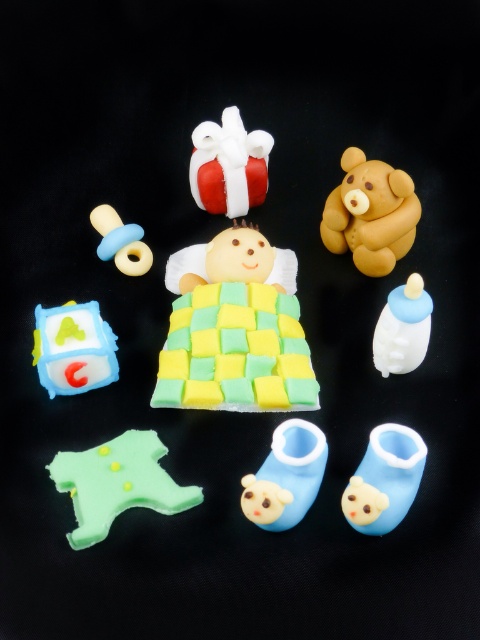
Which is behind, point (75, 532) or point (56, 308)?

The point (56, 308) is behind.

Is point (70, 532) more distant than point (64, 324)?

That is False.

The height and width of the screenshot is (640, 480). I want to click on green matte baby bib at lower left, so click(x=118, y=483).

Does blue rubber booties at lower center appear on the right side of yellow matte pacifier at upper left?

Yes, blue rubber booties at lower center is to the right of yellow matte pacifier at upper left.

Based on the photo, between blue rubber booties at lower center and yellow matte pacifier at upper left, which one has less height?

yellow matte pacifier at upper left is shorter.

Does point (263, 512) lie in front of point (98, 256)?

That is True.

The width and height of the screenshot is (480, 640). What are the coordinates of `blue rubber booties at lower center` in the screenshot? It's located at (286, 476).

Is point (223, 284) positioned behind point (407, 307)?

Yes.

The image size is (480, 640). What do you see at coordinates (235, 328) in the screenshot?
I see `matte yellow fabric baby at center` at bounding box center [235, 328].

Where is `matte yellow fabric baby at center`? This screenshot has height=640, width=480. matte yellow fabric baby at center is located at coordinates (235, 328).